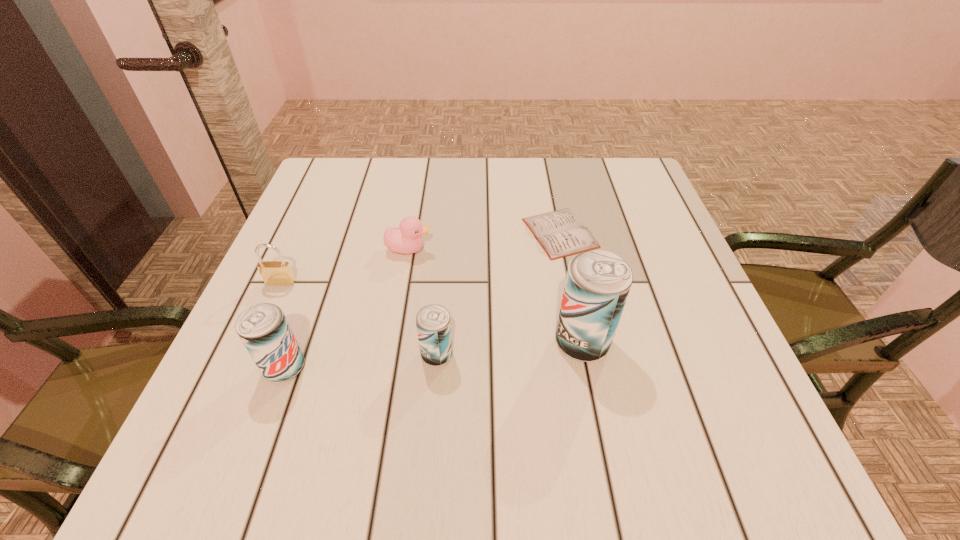
Find the location of `blank region between the diary and the second beer can from left to right`. blank region between the diary and the second beer can from left to right is located at coordinates (498, 294).

Where is `unoccupied position between the leftmost beer can and the diary`? unoccupied position between the leftmost beer can and the diary is located at coordinates (422, 300).

Locate an element on the screen. The width and height of the screenshot is (960, 540). vacant space in between the shortest beer can and the fourth nearest object is located at coordinates (359, 319).

The height and width of the screenshot is (540, 960). I want to click on vacant space that's between the leftmost object and the fifth tallest object, so (x=345, y=266).

The image size is (960, 540). What are the coordinates of `vacant area between the leftmost object and the shortest beer can` in the screenshot? It's located at (359, 319).

The height and width of the screenshot is (540, 960). What are the coordinates of `the closest object to the padlock` in the screenshot? It's located at (263, 328).

At what (x,y) coordinates should I click in order to perform the action: click on the closest object to the leftmost object. Please return your answer as a coordinate pair (x, y). This screenshot has height=540, width=960. Looking at the image, I should click on click(x=263, y=328).

This screenshot has height=540, width=960. In order to click on beer can that is the third nearest to the padlock in this screenshot , I will do `click(598, 282)`.

Locate an element on the screen. The width and height of the screenshot is (960, 540). the closest beer can relative to the leftmost beer can is located at coordinates (433, 324).

Find the location of `vacant space that satisfies the following two spatial constraints: 1. on the front-facing side of the third object from left to right; 2. on the left side of the second beer can from left to right`. vacant space that satisfies the following two spatial constraints: 1. on the front-facing side of the third object from left to right; 2. on the left side of the second beer can from left to right is located at coordinates (391, 355).